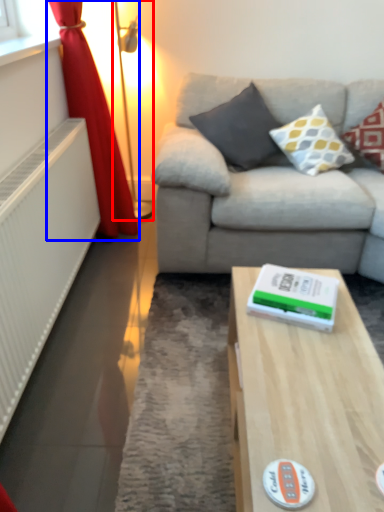
Question: Which point is further to the camera, table lamp (highlighted by a red box) or curtain (highlighted by a blue box)?

Choices:
 (A) table lamp
 (B) curtain

Answer: (A)